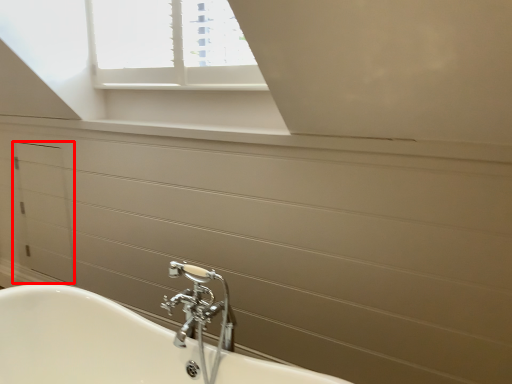
Question: From the image's perspective, where is drawer (annotated by the red box) located in relation to tap in the image?

Choices:
 (A) below
 (B) above

Answer: (B)